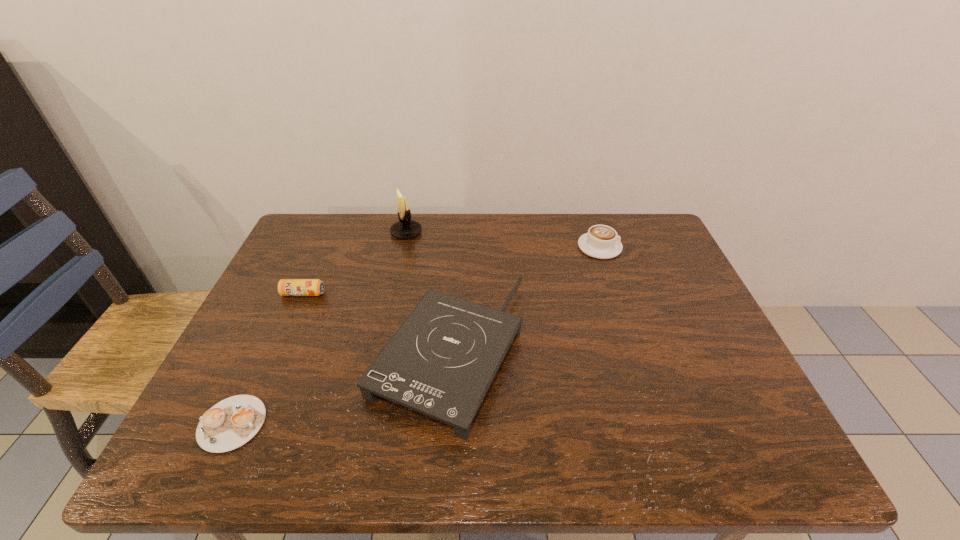
Find the location of a particular element. The height and width of the screenshot is (540, 960). the tallest object is located at coordinates (405, 228).

Identify the location of the rightmost object. [x=601, y=241].

Locate an element on the screen. Image resolution: width=960 pixels, height=540 pixels. the right cappuccino is located at coordinates (601, 241).

You are a GUI agent. You are given a task and a screenshot of the screen. Output one action in this format:
    pyautogui.click(x=<x>, y=<y>)
    Task: Click on the hotplate
    
    Given the screenshot: What is the action you would take?
    pyautogui.click(x=442, y=360)

Identify the location of beer can. The width and height of the screenshot is (960, 540). (286, 287).

Identify the location of the shorter cappuccino. The image size is (960, 540). (232, 422).

This screenshot has width=960, height=540. Identify the location of the left cappuccino. (232, 422).

You are a GUI agent. You are given a task and a screenshot of the screen. Output one action in this format:
    pyautogui.click(x=<x>, y=<y>)
    Task: Click on the vacant space positioned on the right of the tallest object
    
    Given the screenshot: What is the action you would take?
    pyautogui.click(x=472, y=232)

In order to click on vacant space located 0.240m on the back of the hotplate in this screenshot , I will do `click(458, 236)`.

Identify the location of blank space located on the front of the fourth tallest object. The width and height of the screenshot is (960, 540). (290, 324).